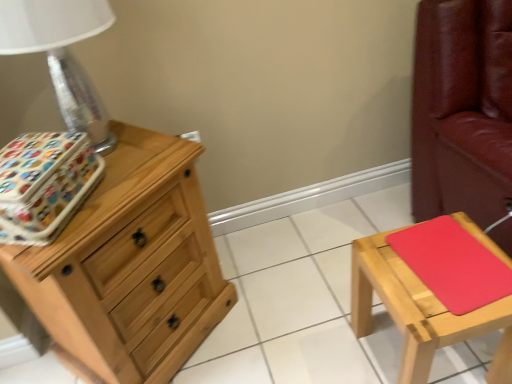
Question: In terms of width, does natural wood chest of drawers at left look wider or thinner when compared to patterned fabric storage box at left?

Choices:
 (A) thin
 (B) wide

Answer: (B)

Question: Is natural wood chest of drawers at left inside the boundaries of patterned fabric storage box at left, or outside?

Choices:
 (A) outside
 (B) inside

Answer: (A)

Question: Which is farther from the patterned fabric storage box at left?

Choices:
 (A) red matte pad at right
 (B) metallic silver table lamp at left
 (C) matte wood stool at right
 (D) natural wood chest of drawers at left

Answer: (A)

Question: Considering the real-world distances, which object is farthest from the metallic silver table lamp at left?

Choices:
 (A) natural wood chest of drawers at left
 (B) patterned fabric storage box at left
 (C) matte wood stool at right
 (D) red matte pad at right

Answer: (D)